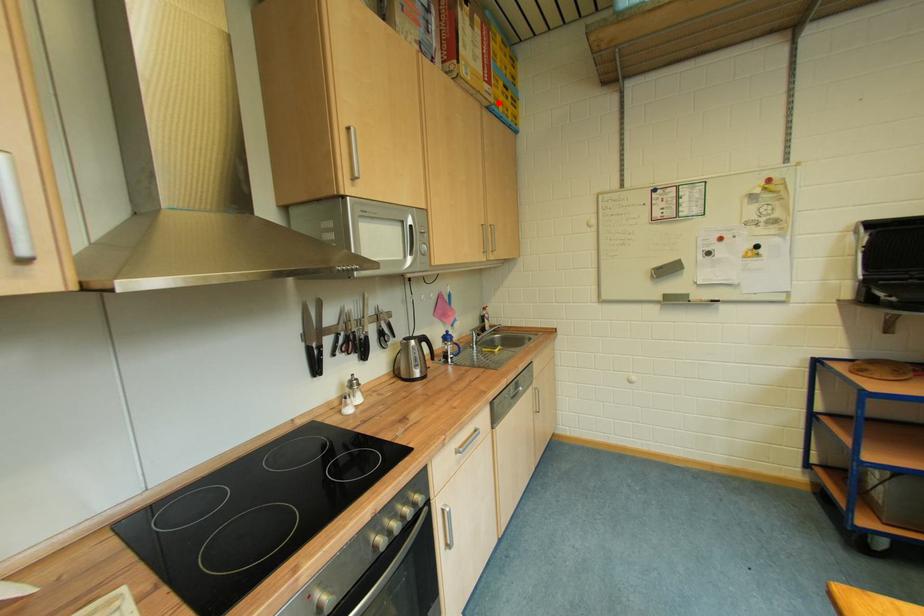
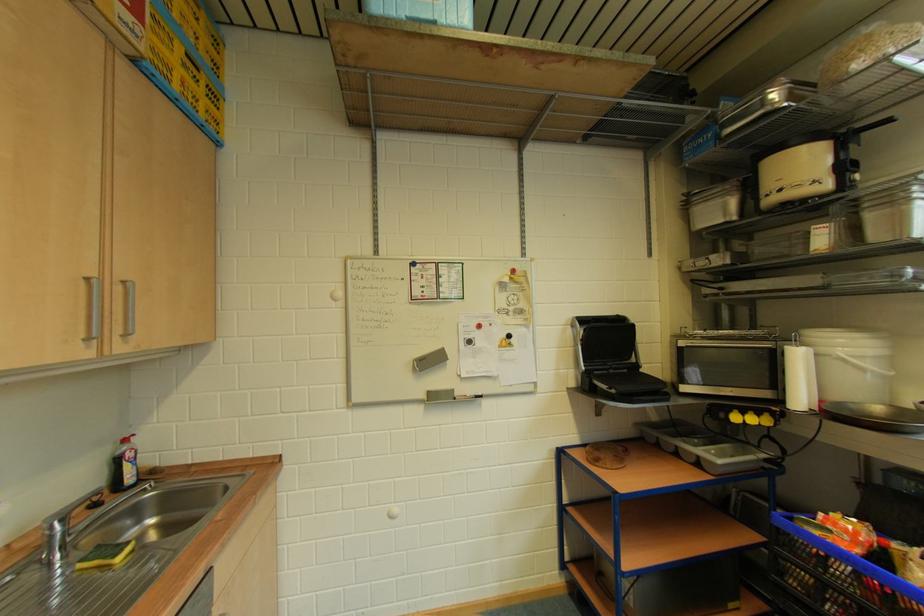
The point at the highlighted location is marked in the first image. Where is the corresponding point in the second image?

(150, 50)